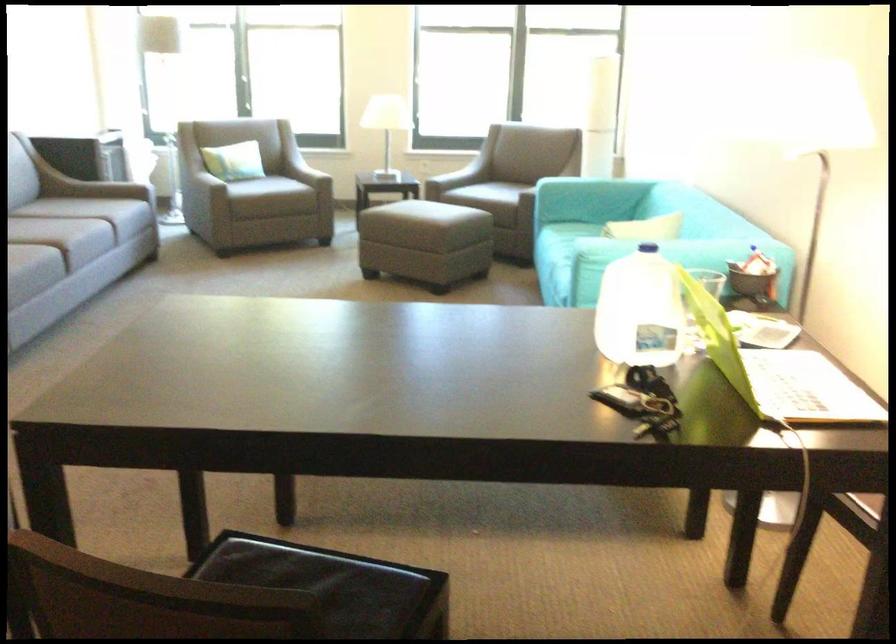
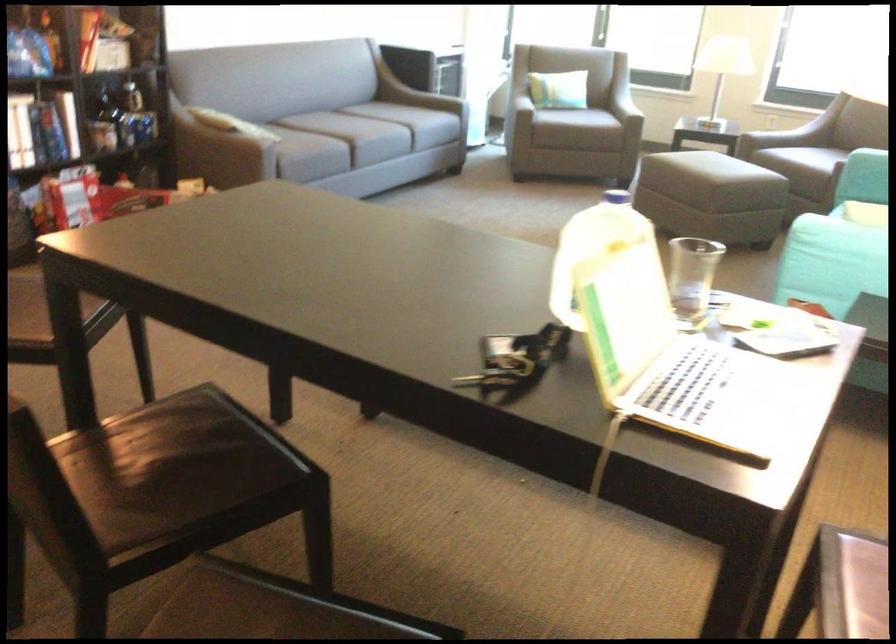
Question: In a continuous first-person perspective shot, in which direction is the camera moving?

Choices:
 (A) Left
 (B) Right
 (C) Forward
 (D) Backward

Answer: (D)